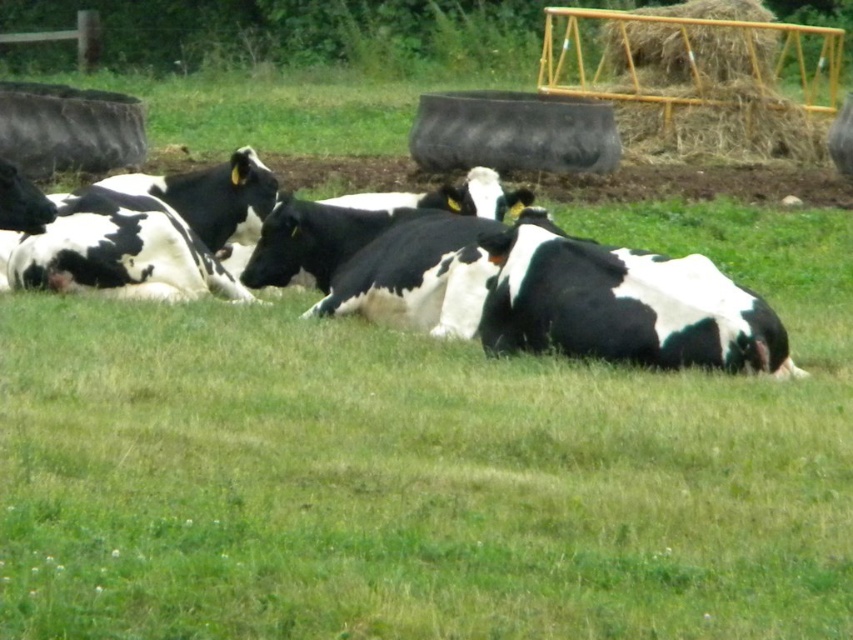
You are a farmer checking the feeding area. You see the black and white cow at center and the yellow metal hay at upper right. Which object is located above the other?

The yellow metal hay at upper right is located above the black and white cow at center because the cow is positioned under the hay.

You are a farmer standing at the origin point of the field. You need to locate the black and white cow at center. What are the coordinates of the cow?

The coordinates of the black and white cow at center are at point (614, 305).

You are a farmer who needs to check the feed supply. You are currently standing next to the black and white cow at center. Which direction should you walk to reach the yellow metal hay at upper right?

You should walk to the right because the black and white cow at center is to the left of the yellow metal hay at upper right.